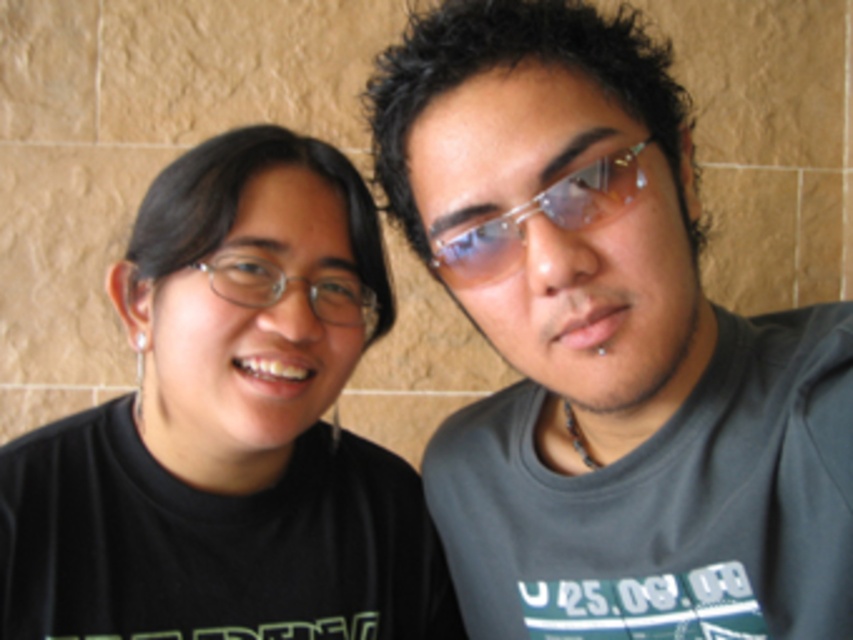
Consider the image. You are a photographer adjusting your camera settings to focus on the gray matte t shirt at right. The camera has a focus point at coordinates point (610, 355). Is this focus point correctly positioned to capture the gray matte t shirt at right?

Yes, the focus point at point (610, 355) is correctly positioned to capture the gray matte t shirt at right because the Objects Description states that this point marks the location of the gray matte t shirt at right.

You are standing at the point marked as point (238, 317) in the image. You want to take a photo of the two people in the scene without moving your position. Can you fit both people into your camera frame if your camera has a maximum horizontal field of view of 30 inches?

The point marked as point (238, 317) is 29.90 inches away from the viewer. Since the camera has a maximum horizontal field of view of 30 inches, you can fit both people into the frame as the distance is within the camera capabilities.

From the picture: You are trying to decide which pair of glasses to take with you on a trip. You have the black matte glasses at left and the clear plastic glasses at center. Which pair has a larger width?

The black matte glasses at left might be wider than clear plastic glasses at center according to the description.